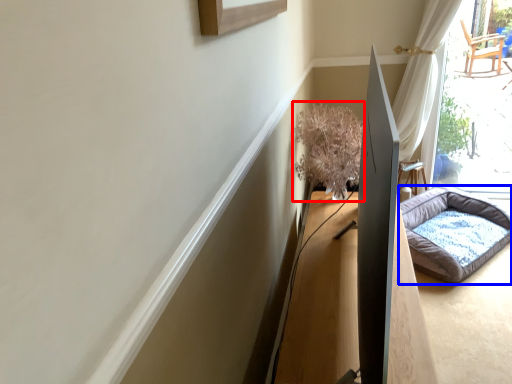
Question: Which of the following is the farthest to the observer, plant (highlighted by a red box) or dog bed (highlighted by a blue box)?

Choices:
 (A) plant
 (B) dog bed

Answer: (B)